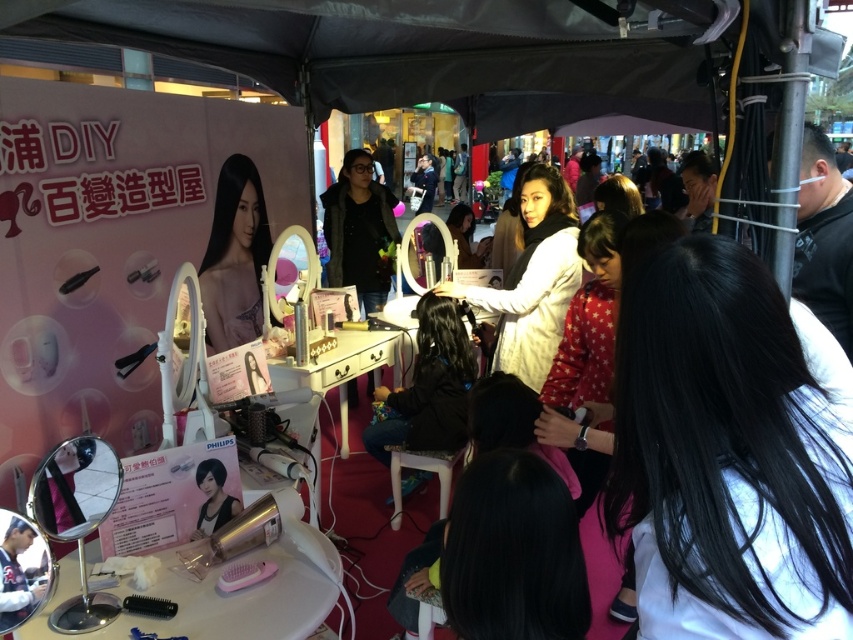
You are a customer in the DIY Hair Styling House booth. You see the black silky hair at center and the white matte hairdresser at center. Which object takes up more space in the image?

The white matte hairdresser at center takes up more space in the image because it is larger than the black silky hair at center.

You are standing in front of the DIY Hair Styling House booth and want to touch both points marked in the image. Which point, point [720,435] or point [503,282], will you reach first?

Point [720,435] is closer to the viewer than point [503,282], so you will reach point [720,435] first.

You are a customer who wants to style your hair. You are standing in the booth and see the black silky hair at center and the white matte hairdresser at center. How far apart are these two items?

The black silky hair at center is 1.98 meters from the white matte hairdresser at center.